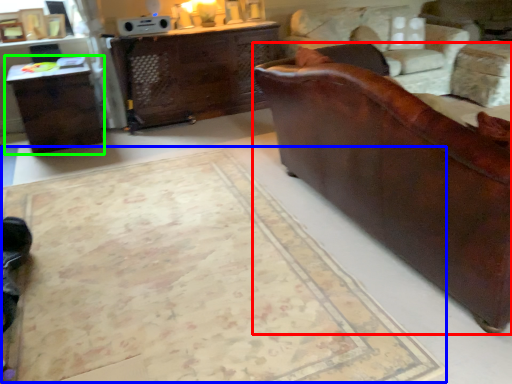
Question: Based on their relative distances, which object is farther from studio couch (highlighted by a red box)? Choose from mat (highlighted by a blue box) and table (highlighted by a green box).

Choices:
 (A) mat
 (B) table

Answer: (B)